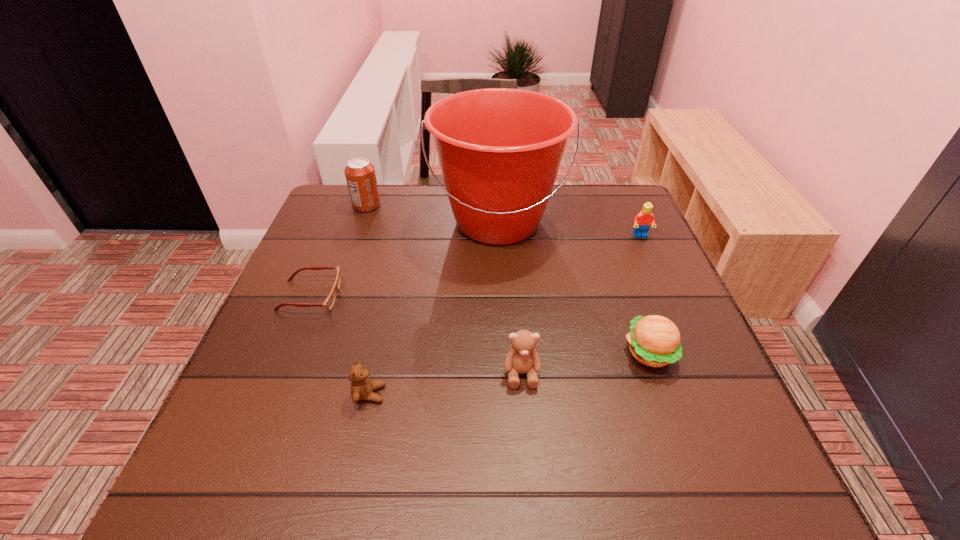
The width and height of the screenshot is (960, 540). Find the location of `Lego that is at the right edge`. Lego that is at the right edge is located at coordinates (642, 222).

Where is `hamburger that is at the right edge`? Image resolution: width=960 pixels, height=540 pixels. hamburger that is at the right edge is located at coordinates (654, 340).

Where is `object present at the far left corner`? Image resolution: width=960 pixels, height=540 pixels. object present at the far left corner is located at coordinates (360, 175).

The height and width of the screenshot is (540, 960). Find the location of `vacant space at the far edge`. vacant space at the far edge is located at coordinates (418, 231).

Locate an element on the screen. This screenshot has height=540, width=960. free space at the near edge of the desktop is located at coordinates 653,455.

At what (x,y) coordinates should I click in order to perform the action: click on free location at the left edge of the desktop. Please return your answer as a coordinate pair (x, y). This screenshot has width=960, height=540. Looking at the image, I should click on (324, 252).

Identify the location of vacant space at the right edge of the desktop. The width and height of the screenshot is (960, 540). (640, 277).

Find the location of a particular element. free space at the far left corner is located at coordinates (320, 229).

The width and height of the screenshot is (960, 540). In the image, there is a desktop. What are the coordinates of `vacant space at the far right corner` in the screenshot? It's located at (624, 228).

Identify the location of vacant space at the near right corner of the desktop. (741, 469).